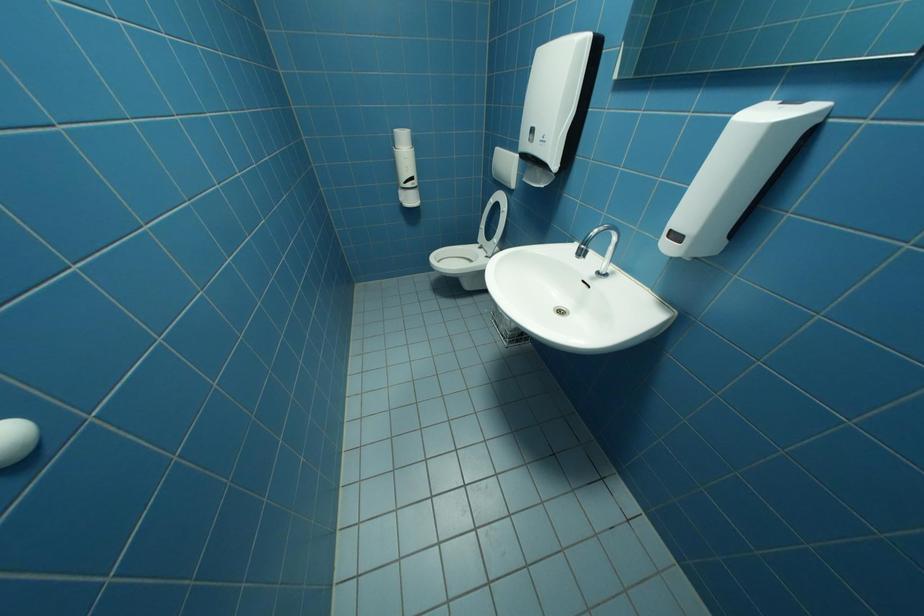
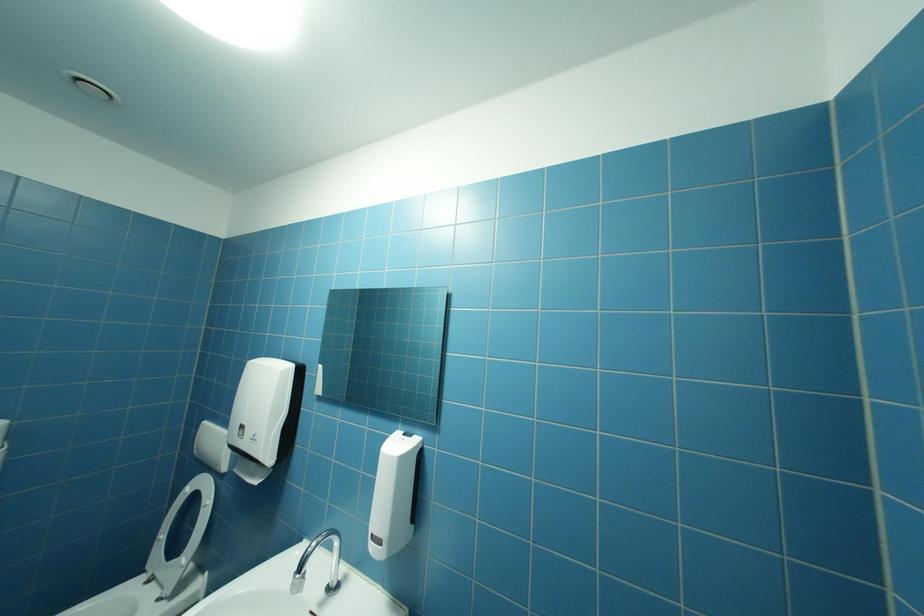
In the scene shown: The images are taken continuously from a first-person perspective. In which direction is your viewpoint rotating?

The rotation direction of the camera is right-up.